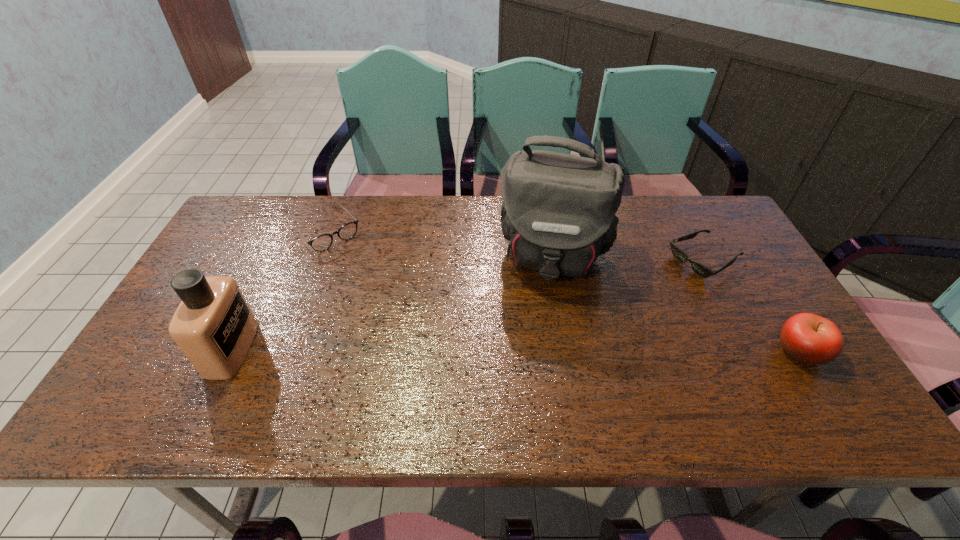
Image resolution: width=960 pixels, height=540 pixels. I want to click on vacant space located through the lenses of the second shortest object, so [380, 291].

Locate an element on the screen. The image size is (960, 540). free space located 0.270m on the open flap of the tallest object is located at coordinates pos(531,377).

Find the location of `free spot located on the open flap of the tallest object`. free spot located on the open flap of the tallest object is located at coordinates (530, 381).

Locate an element on the screen. The width and height of the screenshot is (960, 540). vacant space located 0.210m on the open flap of the tallest object is located at coordinates (x=535, y=356).

This screenshot has width=960, height=540. In order to click on vacant space located 0.360m on the front-facing side of the sunglasses in this screenshot , I will do `click(582, 324)`.

The width and height of the screenshot is (960, 540). Identify the location of vacant space situated 0.330m on the front-facing side of the sunglasses. (591, 320).

This screenshot has height=540, width=960. I want to click on free space located 0.380m on the front-facing side of the sunglasses, so click(x=576, y=327).

The image size is (960, 540). Find the location of `spectacles situated at the far edge`. spectacles situated at the far edge is located at coordinates (321, 243).

Locate an element on the screen. shoulder bag that is at the far edge is located at coordinates (558, 214).

Identify the location of sunglasses that is at the far edge. (700, 269).